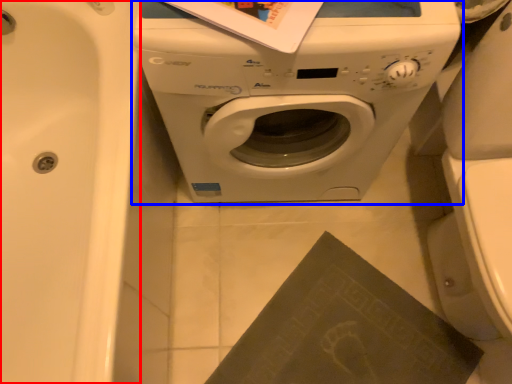
Question: Among these objects, which one is farthest to the camera, bath (highlighted by a red box) or washing machine (highlighted by a blue box)?

Choices:
 (A) bath
 (B) washing machine

Answer: (B)